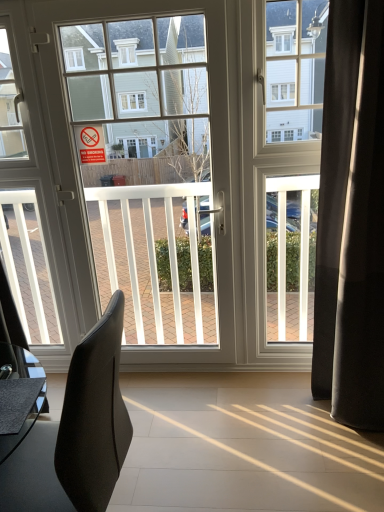
Locate an element on the screen. This screenshot has width=384, height=512. vacant area situated below white glossy door at center (from a real-world perspective) is located at coordinates (167, 374).